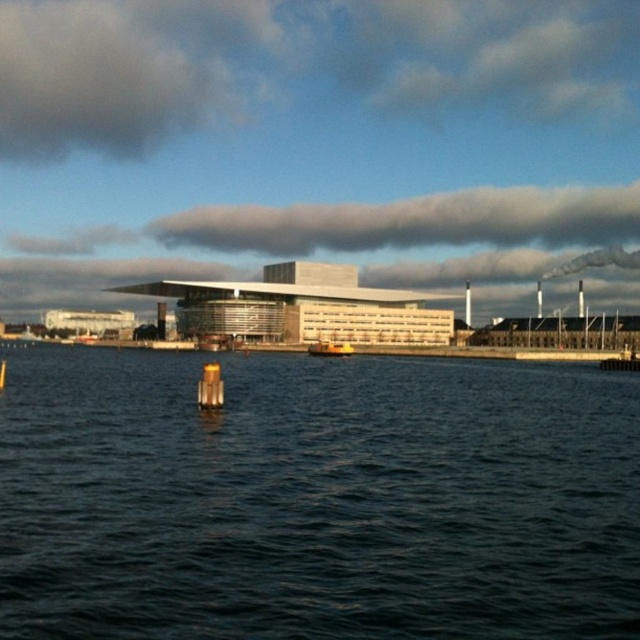
You are standing at the waterfront near the modern building and want to locate two points marked in the image. The first point is at coordinates point (52, 504) and the second is at point (420, 230). Which point is closer to you when viewed from your current position?

Point (52, 504) is in front of point (420, 230), so it is closer to you.